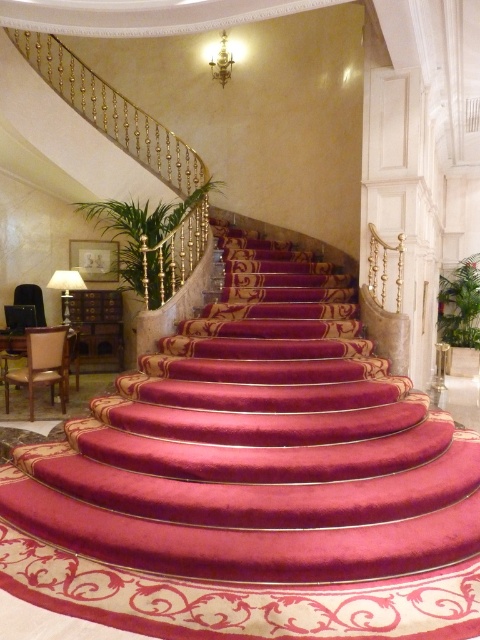
Can you confirm if matte gold lamp at left is wider than gold metallic chandelier at upper center?

Yes.

Does matte gold lamp at left have a greater height compared to gold metallic chandelier at upper center?

Incorrect, matte gold lamp at left's height is not larger of gold metallic chandelier at upper center's.

Image resolution: width=480 pixels, height=640 pixels. Identify the location of matte gold lamp at left. (66, 288).